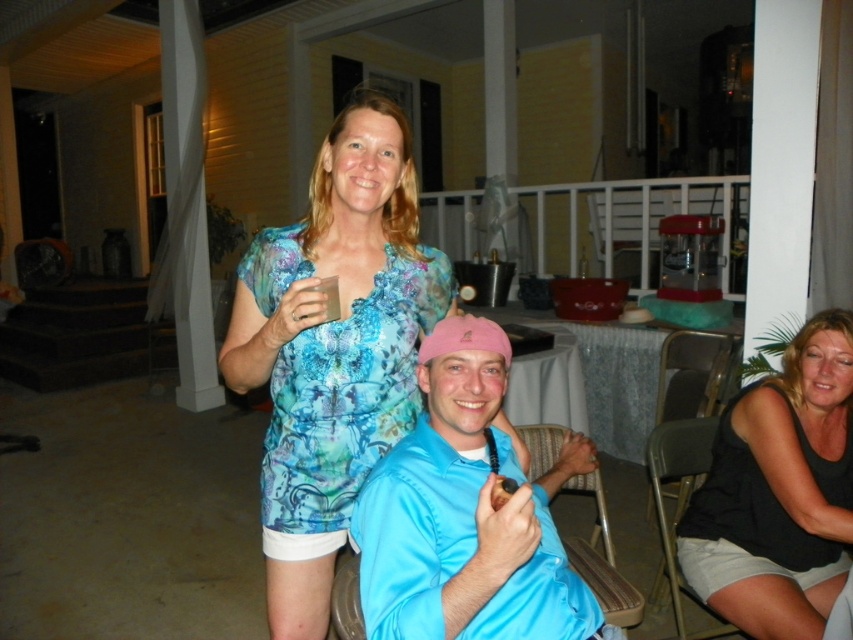
Question: Considering the real-world distances, which object is closest to the textured blue blouse at center?

Choices:
 (A) woven fabric chair at center
 (B) metallic gray chair at lower right

Answer: (A)

Question: Which is nearer to the blue satin shirt at center?

Choices:
 (A) woven fabric chair at center
 (B) textured blue blouse at center
 (C) black cotton tank top at lower right
 (D) black fabric chair at lower right

Answer: (B)

Question: Can you confirm if textured blue blouse at center is positioned to the right of blue satin shirt at center?

Choices:
 (A) no
 (B) yes

Answer: (A)

Question: Does blue satin shirt at center come behind black fabric chair at lower right?

Choices:
 (A) no
 (B) yes

Answer: (A)

Question: Which point appears closest to the camera in this image?

Choices:
 (A) (469, 465)
 (B) (672, 493)
 (C) (799, 384)
 (D) (358, 403)

Answer: (A)

Question: Considering the relative positions of blue satin shirt at center and black cotton tank top at lower right in the image provided, where is blue satin shirt at center located with respect to black cotton tank top at lower right?

Choices:
 (A) right
 (B) left

Answer: (B)